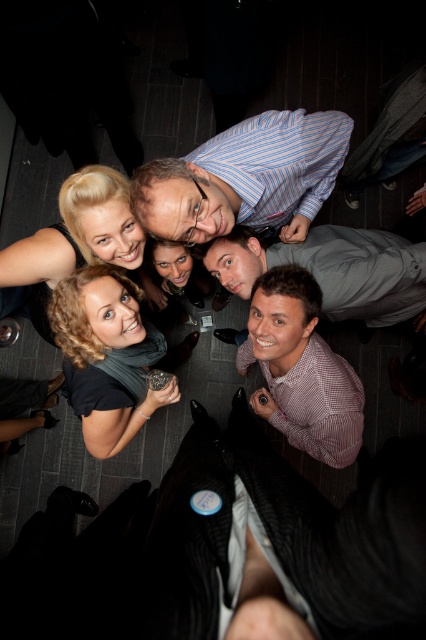
Which is behind, point (293, 326) or point (374, 282)?

The point (374, 282) is more distant.

Is checkered fabric shirt at lower right to the right of gray fabric shirt at center from the viewer's perspective?

No, checkered fabric shirt at lower right is not to the right of gray fabric shirt at center.

Locate an element on the screen. Image resolution: width=426 pixels, height=640 pixels. checkered fabric shirt at lower right is located at coordinates (301, 369).

Who is positioned more to the left, black matte scarf at center or gray fabric shirt at center?

black matte scarf at center is more to the left.

Does black matte scarf at center appear on the right side of gray fabric shirt at center?

No, black matte scarf at center is not to the right of gray fabric shirt at center.

Who is more forward, (86, 388) or (371, 241)?

Point (86, 388)

Where is `black matte scarf at center`? This screenshot has width=426, height=640. black matte scarf at center is located at coordinates (108, 355).

Who is more forward, [224,208] or [259,342]?

Positioned in front is point [224,208].

Does blue striped shirt at upper center have a greater height compared to checkered fabric shirt at lower right?

In fact, blue striped shirt at upper center may be shorter than checkered fabric shirt at lower right.

Image resolution: width=426 pixels, height=640 pixels. I want to click on blue striped shirt at upper center, so click(245, 177).

Locate an element on the screen. The width and height of the screenshot is (426, 640). blue striped shirt at upper center is located at coordinates (245, 177).